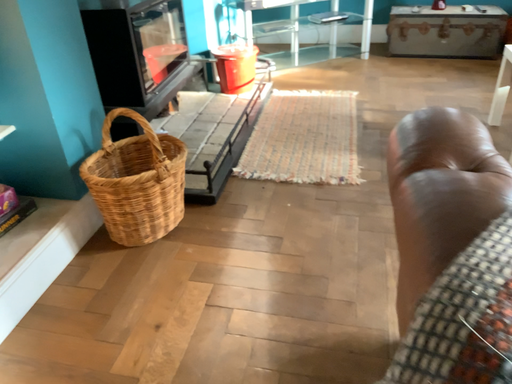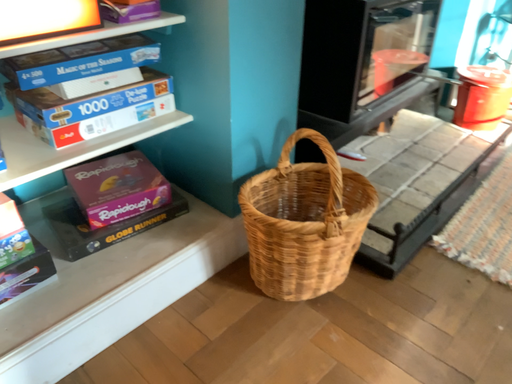
Question: Which way did the camera rotate in the video?

Choices:
 (A) rotated left
 (B) rotated right

Answer: (A)